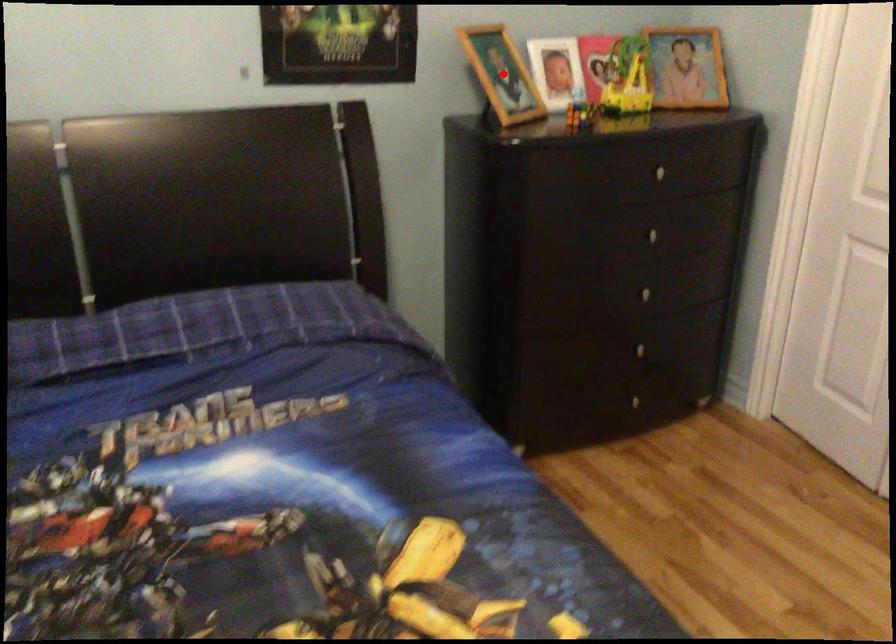
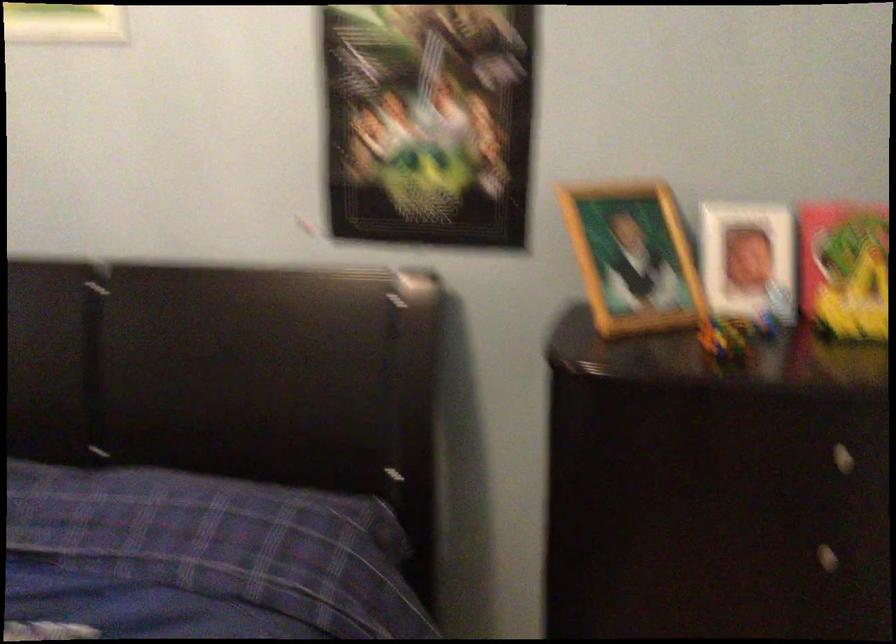
Question: I am providing you with two images of the same scene from different viewpoints. Image1 has a red point marked. In image2, the corresponding 3D location appears at what relative position? Reply with the corresponding letter.

Choices:
 (A) Closer
 (B) Farther

Answer: (A)